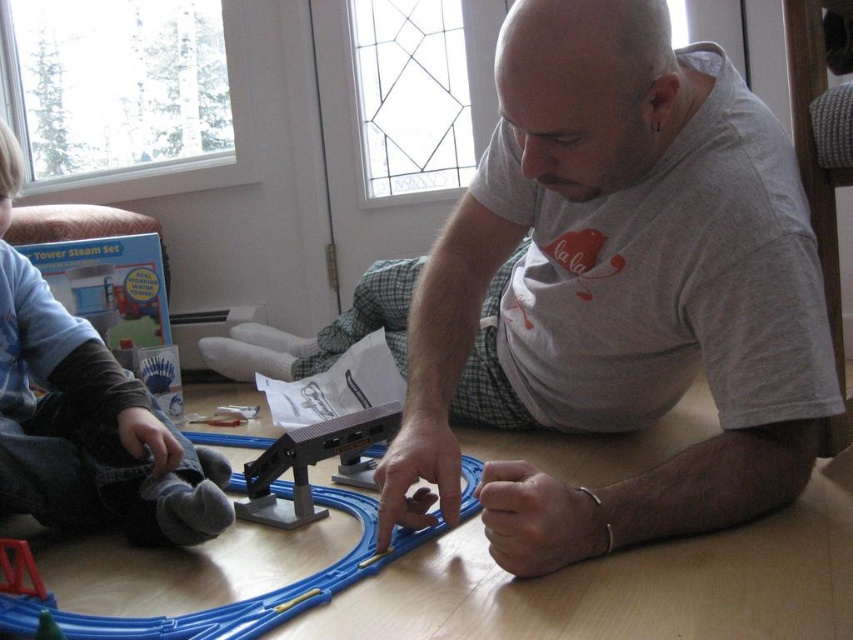
You are standing in the living room and want to take a photo of the matte gray shirt at center. If your camera can focus on objects within 30 inches, will you need to move closer or farther away?

The matte gray shirt at center is 33.76 inches away from the camera, which is beyond the 30 inches focus range. You need to move closer to ensure the camera can focus properly.

You are a photographer taking a picture of the scene. You want to ensure both the matte gray shirt at center and the metallic gray track at center are visible in the frame. Which object should you position closer to the left side of the camera to achieve this?

To position the matte gray shirt at center closer to the left side of the camera, you should adjust the framing so that the matte gray shirt at center is shifted leftward relative to the metallic gray track at center, since the matte gray shirt at center is currently to the right of the metallic gray track at center.

In the scene shown: You are helping assemble a toy train set and need to place the blue plastic track at center and the metallic gray track at center. Which track should you choose if you need a larger one for the train to pass through?

The blue plastic track at center is larger in size than the metallic gray track at center, so you should choose the blue plastic track at center for the train to pass through.